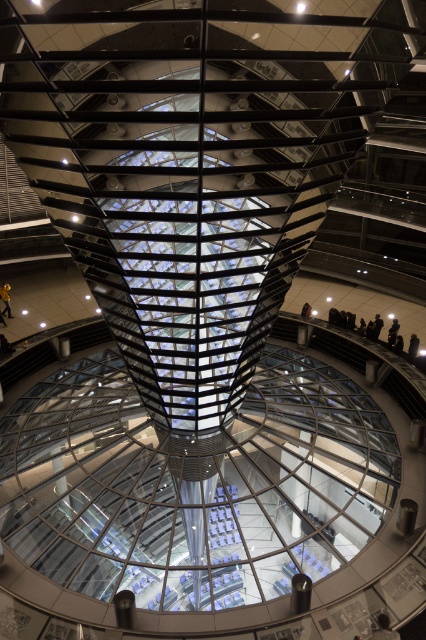
Question: Which point is closer to the camera?

Choices:
 (A) black leather jacket at upper center
 (B) yellow jacket at center
 (C) black leather jacket at center

Answer: (A)

Question: Which object is the closest to the yellow jacket at center?

Choices:
 (A) dark brown leather jacket at lower right
 (B) black leather jacket at center

Answer: (B)

Question: Where is yellow jacket at center located in relation to black leather jacket at upper center in the image?

Choices:
 (A) below
 (B) above

Answer: (B)

Question: Does dark brown leather jacket at lower right have a larger size compared to black leather jacket at center?

Choices:
 (A) yes
 (B) no

Answer: (B)

Question: Which object is closer to the camera taking this photo?

Choices:
 (A) black leather jacket at center
 (B) black leather jacket at upper center

Answer: (B)

Question: Where is dark brown leather jacket at lower right located in relation to yellow jacket at center in the image?

Choices:
 (A) left
 (B) right

Answer: (B)